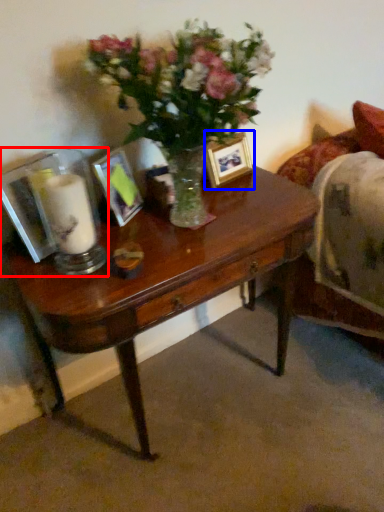
Question: Which object is further to the camera taking this photo, tableware (highlighted by a red box) or picture frame (highlighted by a blue box)?

Choices:
 (A) tableware
 (B) picture frame

Answer: (B)